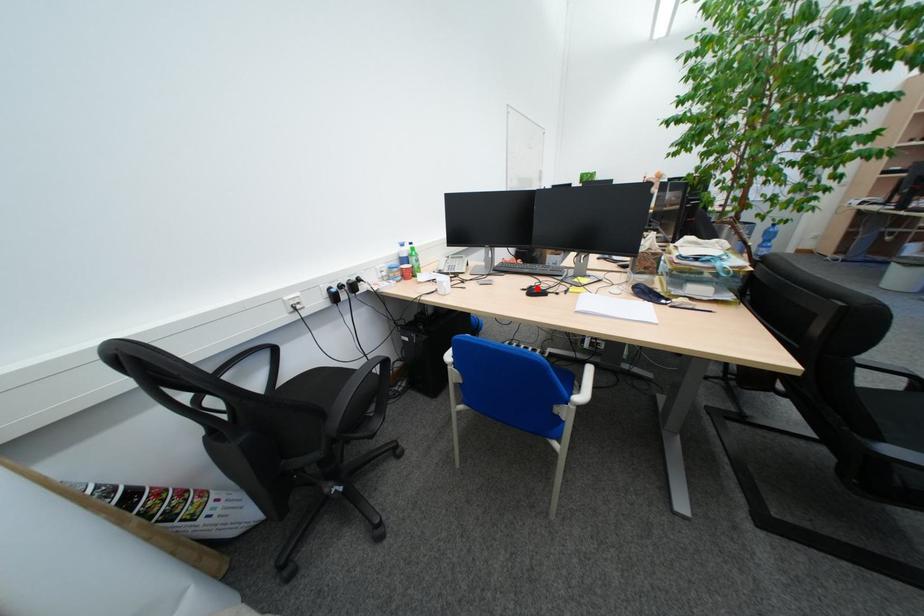
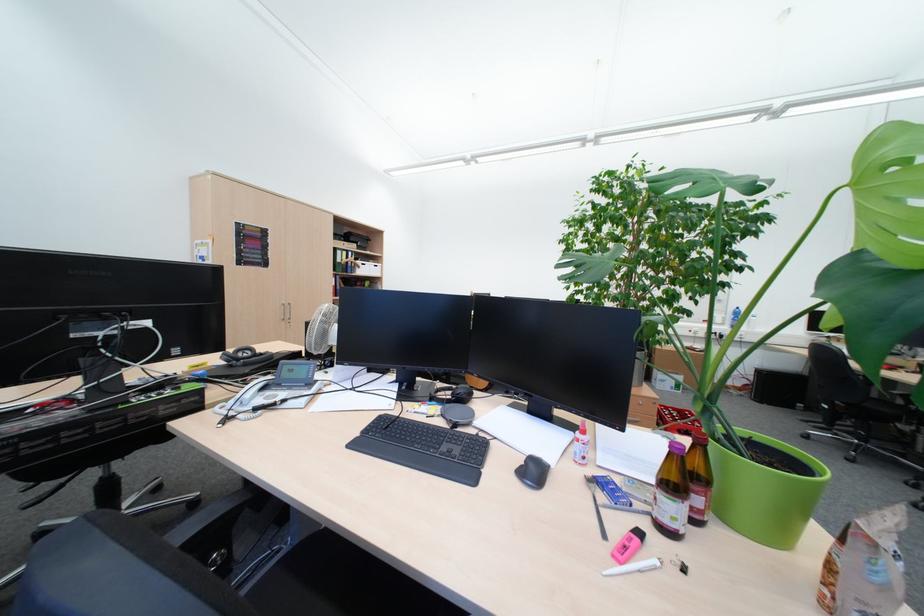
Question: I am providing you with two images of the same scene from different viewpoints. A red point is marked on the first image. At the location where the point appears in image 1, is it still visible in image 2?

Choices:
 (A) Yes
 (B) No

Answer: (B)